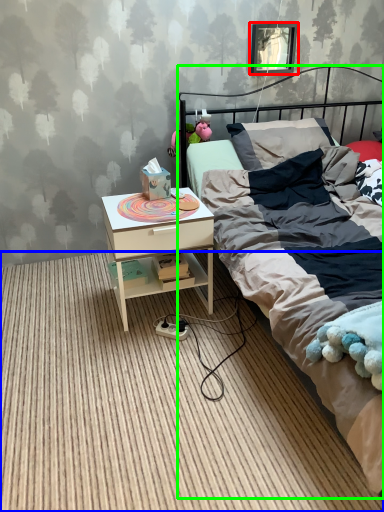
Question: Estimate the real-world distances between objects in this image. Which object is closer to picture frame (highlighted by a red box), plain (highlighted by a blue box) or bed (highlighted by a green box)?

Choices:
 (A) plain
 (B) bed

Answer: (B)